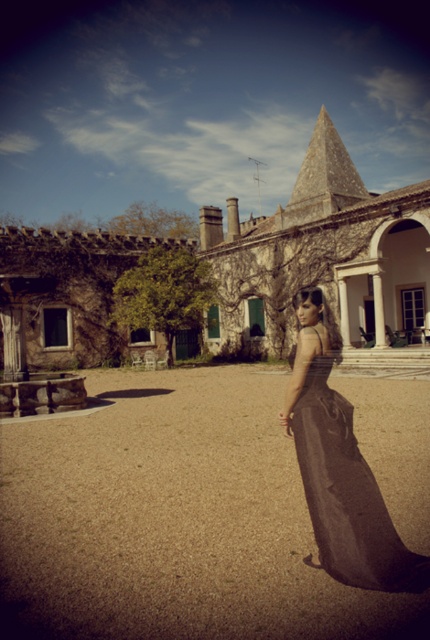
Question: Does brown gravel at center appear over matte black dress at center?

Choices:
 (A) no
 (B) yes

Answer: (A)

Question: Which object is closer to the camera taking this photo?

Choices:
 (A) matte black dress at center
 (B) brown gravel at center

Answer: (B)

Question: Is brown gravel at center behind matte black dress at center?

Choices:
 (A) no
 (B) yes

Answer: (A)

Question: Does brown gravel at center have a smaller size compared to matte black dress at center?

Choices:
 (A) yes
 (B) no

Answer: (B)

Question: Which of the following is the closest to the observer?

Choices:
 (A) click(x=15, y=534)
 (B) click(x=383, y=540)

Answer: (B)

Question: Among these points, which one is nearest to the camera?

Choices:
 (A) (39, 435)
 (B) (313, 445)

Answer: (B)